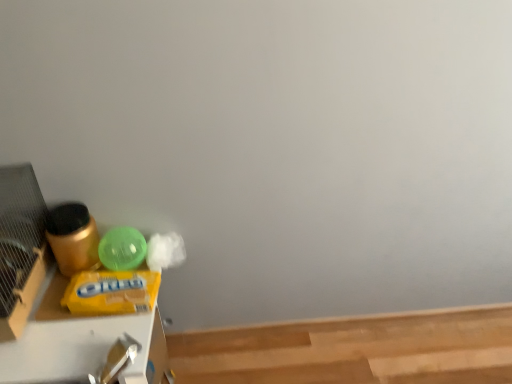
Where is `vacant area on top of light brown smooth wood at lower right (from a real-world perspective)`? The height and width of the screenshot is (384, 512). vacant area on top of light brown smooth wood at lower right (from a real-world perspective) is located at coordinates (357, 353).